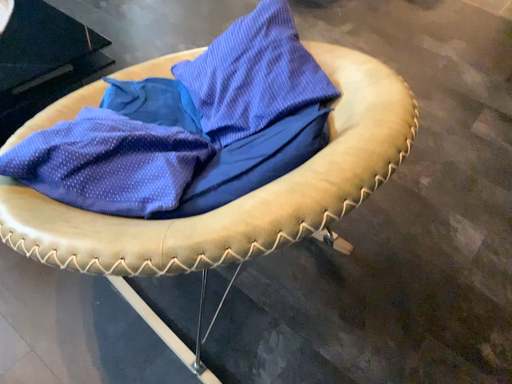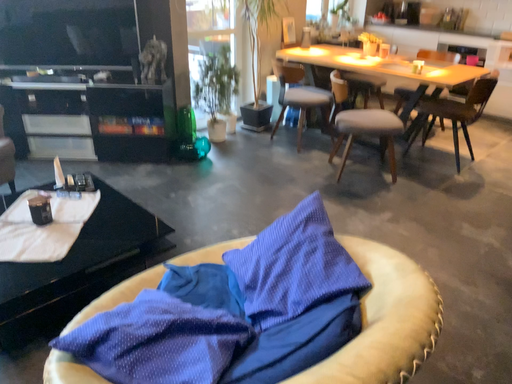
Question: How did the camera likely rotate when shooting the video?

Choices:
 (A) rotated right
 (B) rotated left

Answer: (B)